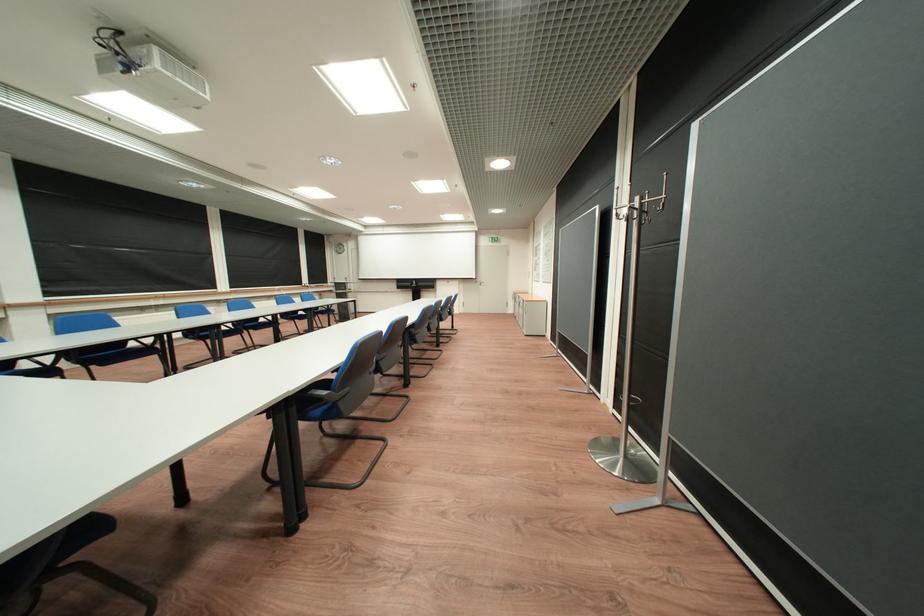
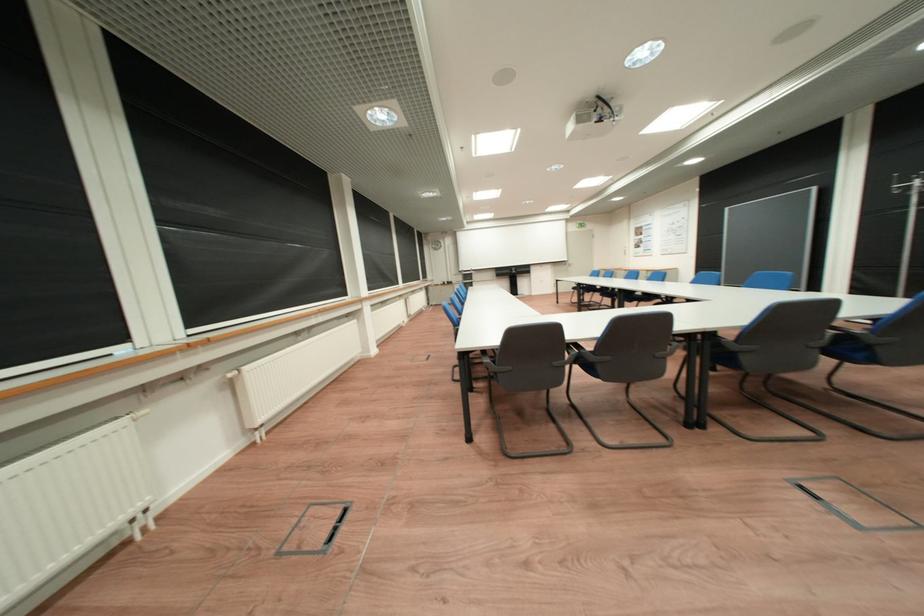
Question: I am providing you with two images of the same scene from different viewpoints. Please identify which objects are invisible in image2.

Choices:
 (A) blue chair sitting surface
 (B) white radiator valve
 (C) white switch
 (D) blue chair armrest

Answer: (A)